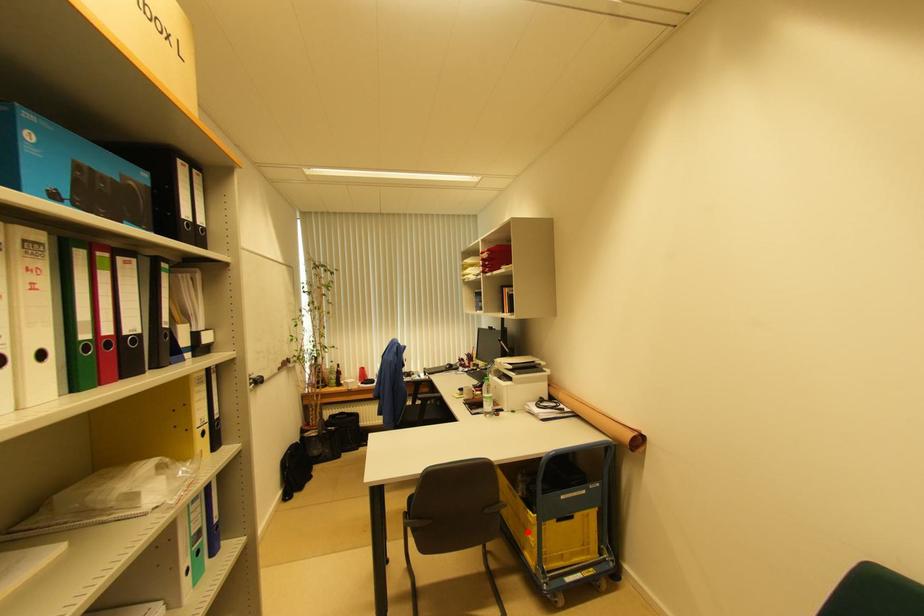
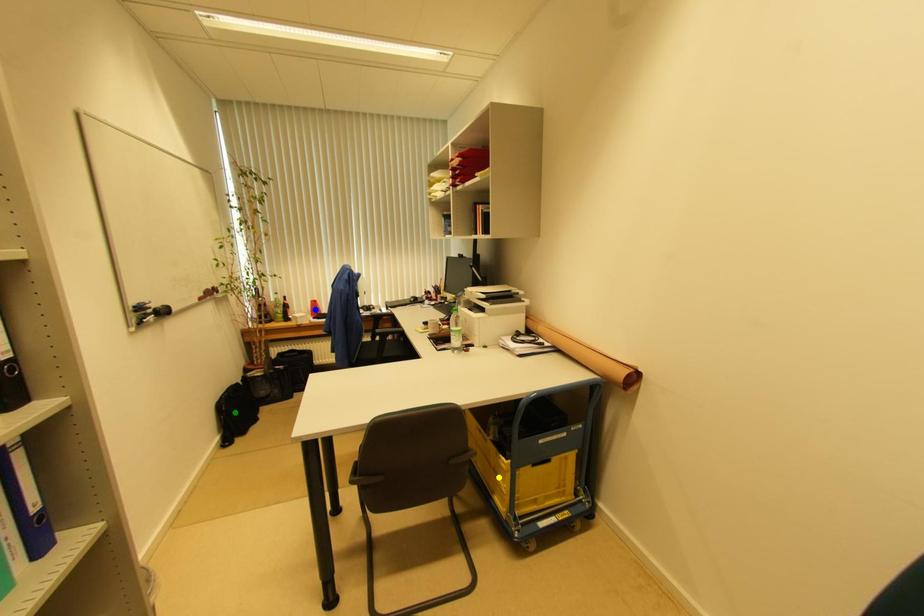
Question: I am providing you with two images of the same scene from different viewpoints. A red point is marked on the first image. You are given multiple points on the second image. In image 2, which mark is for the same physical point as the one in image 1?

Choices:
 (A) yellow point
 (B) green point
 (C) blue point

Answer: (A)